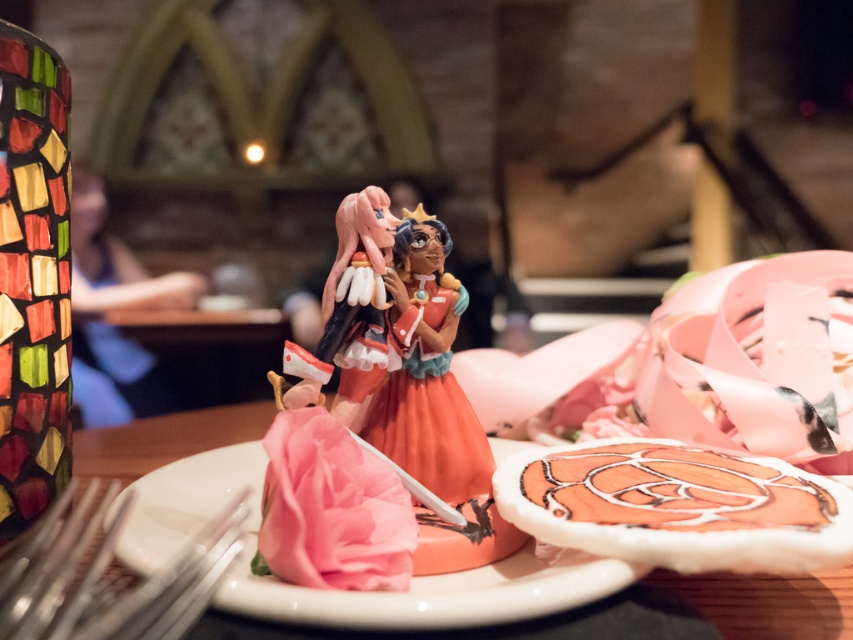
What do you see at coordinates (347, 589) in the screenshot? The height and width of the screenshot is (640, 853). I see `white glossy plate at center` at bounding box center [347, 589].

Looking at this image, is white glossy plate at center wider than metallic silver fork at lower left?

Yes.

Locate an element on the screen. white glossy plate at center is located at coordinates (347, 589).

Between point (447, 573) and point (410, 291), which one is positioned behind?

Positioned behind is point (410, 291).

Does point (357, 604) come in front of point (421, 474)?

Yes, it is.

Find the location of a particular element. The width and height of the screenshot is (853, 640). white glossy plate at center is located at coordinates (347, 589).

Does metallic silver fork at lower left have a smaller size compared to smooth blue shirt at center?

Indeed, metallic silver fork at lower left has a smaller size compared to smooth blue shirt at center.

Is point (84, 496) positioned behind point (90, 291)?

No.

Image resolution: width=853 pixels, height=640 pixels. Identify the location of metallic silver fork at lower left. (106, 577).